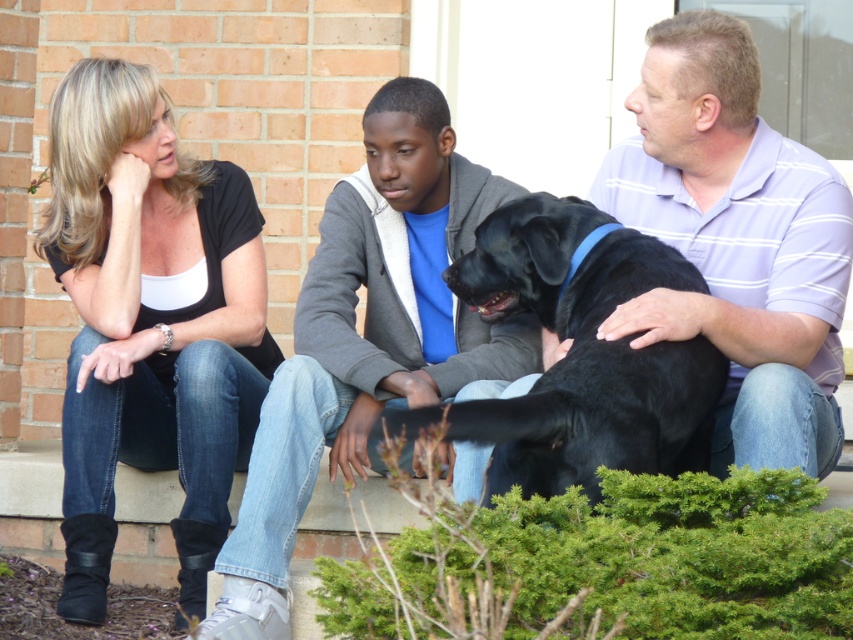
Question: Which point is farther to the camera?

Choices:
 (A) (68, 189)
 (B) (798, 381)

Answer: (A)

Question: Does black matte/black jeans at left have a larger size compared to black smooth dog at center?

Choices:
 (A) yes
 (B) no

Answer: (A)

Question: From the image, what is the correct spatial relationship of matte purple shirt at center in relation to black smooth dog at center?

Choices:
 (A) right
 (B) left

Answer: (A)

Question: Which of the following is the closest to the observer?

Choices:
 (A) smooth gray hoodie at center
 (B) black smooth dog at center
 (C) black matte/black jeans at left
 (D) matte purple shirt at center

Answer: (B)

Question: From the image, what is the correct spatial relationship of black matte/black jeans at left in relation to black smooth dog at center?

Choices:
 (A) right
 (B) left

Answer: (B)

Question: Which is farther from the matte purple shirt at center?

Choices:
 (A) black matte/black jeans at left
 (B) black smooth dog at center
 (C) smooth gray hoodie at center

Answer: (A)